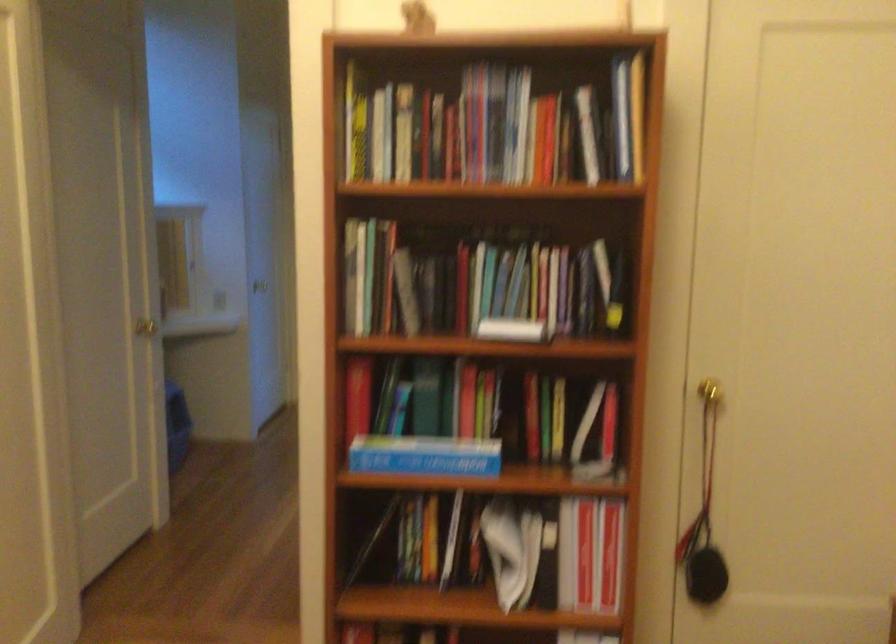
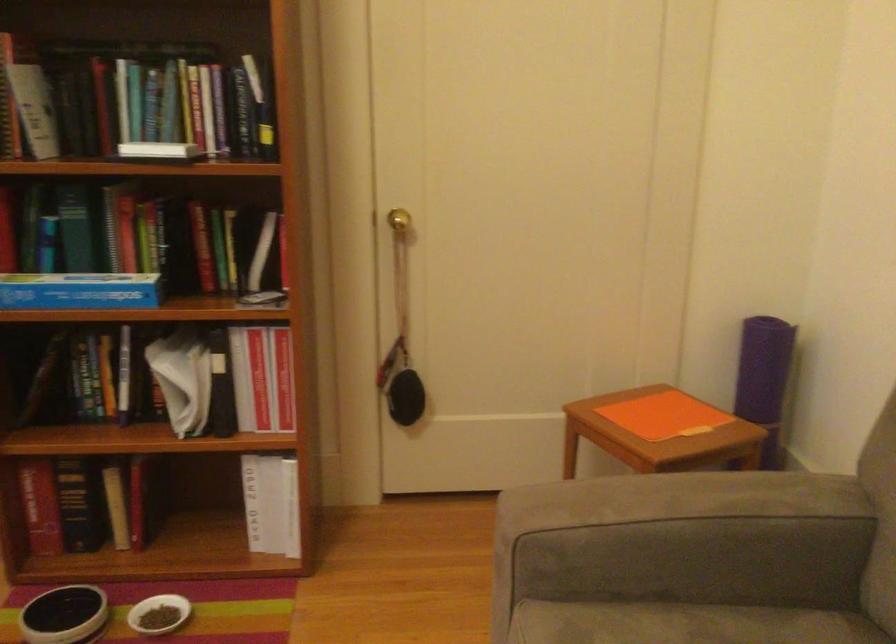
Question: The images are taken continuously from a first-person perspective. In which direction are you moving?

Choices:
 (A) Left
 (B) Right
 (C) Forward
 (D) Backward

Answer: (B)